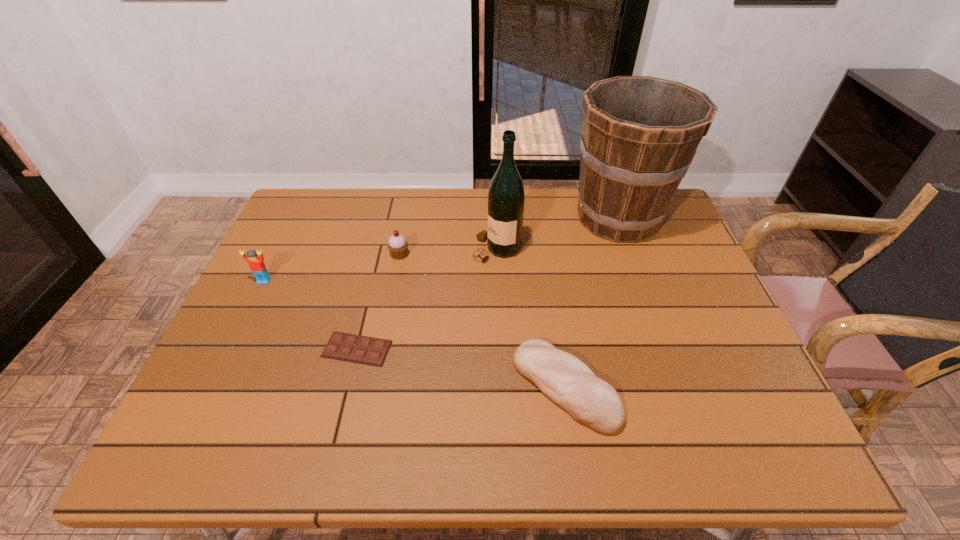
Locate an element on the screen. The height and width of the screenshot is (540, 960). free space between the bread and the Lego is located at coordinates (415, 334).

Locate an element on the screen. Image resolution: width=960 pixels, height=540 pixels. free spot between the cupcake and the shortest object is located at coordinates (378, 302).

Image resolution: width=960 pixels, height=540 pixels. In order to click on free space between the bucket and the bread in this screenshot , I will do [x=591, y=302].

You are a GUI agent. You are given a task and a screenshot of the screen. Output one action in this format:
    pyautogui.click(x=<x>, y=<y>)
    Task: Click on the free point between the cupcake and the shortest object
    
    Given the screenshot: What is the action you would take?
    pyautogui.click(x=378, y=302)

The width and height of the screenshot is (960, 540). I want to click on free space between the wine bottle and the chocolate bar, so click(x=426, y=299).

Find the location of a particular element. The image size is (960, 540). object that is the fifth closest to the bread is located at coordinates (256, 264).

I want to click on object that is the fifth closest to the bucket, so click(x=256, y=264).

Image resolution: width=960 pixels, height=540 pixels. In order to click on vacant region that satisfies the following two spatial constraints: 1. on the surface of the wine bottle; 2. on the front side of the fourth tallest object in this screenshot , I will do pos(496,255).

Where is `free space that satisfies the following two spatial constraints: 1. on the surface of the wine bottle; 2. on the face of the Lego`? This screenshot has height=540, width=960. free space that satisfies the following two spatial constraints: 1. on the surface of the wine bottle; 2. on the face of the Lego is located at coordinates (497, 281).

Where is `free space that satisfies the following two spatial constraints: 1. on the back side of the bucket; 2. on the left side of the third shortest object`? free space that satisfies the following two spatial constraints: 1. on the back side of the bucket; 2. on the left side of the third shortest object is located at coordinates (406, 218).